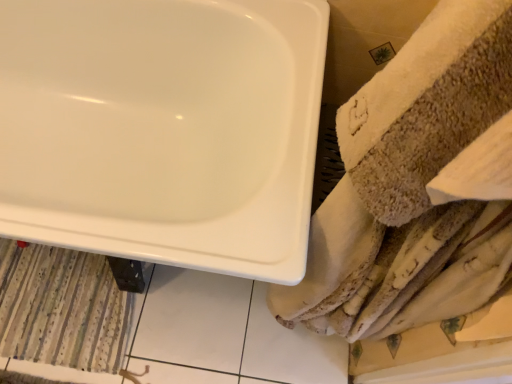
At what (x,y) coordinates should I click in order to perform the action: click on white glossy bathtub at upper left. Please return your answer as a coordinate pair (x, y). This screenshot has height=384, width=512. Looking at the image, I should click on (163, 129).

Measure the distance between white glossy bathtub at upper left and camera.

white glossy bathtub at upper left and camera are 27.33 inches apart.

Describe the element at coordinates (163, 129) in the screenshot. The height and width of the screenshot is (384, 512). I see `white glossy bathtub at upper left` at that location.

Locate an element on the screen. The height and width of the screenshot is (384, 512). striped fabric bath mat at lower left is located at coordinates (62, 308).

The image size is (512, 384). What do you see at coordinates (62, 308) in the screenshot?
I see `striped fabric bath mat at lower left` at bounding box center [62, 308].

The height and width of the screenshot is (384, 512). I want to click on white glossy bathtub at upper left, so click(x=163, y=129).

Which object is positioned more to the left, striped fabric bath mat at lower left or white glossy bathtub at upper left?

striped fabric bath mat at lower left is more to the left.

In the scene shown: Is the position of striped fabric bath mat at lower left more distant than that of white glossy bathtub at upper left?

That is True.

Does point (72, 354) lie behind point (214, 26)?

Yes, point (72, 354) is behind point (214, 26).

From the image's perspective, is striped fabric bath mat at lower left on white glossy bathtub at upper left?

Incorrect, from the image's perspective, striped fabric bath mat at lower left is lower than white glossy bathtub at upper left.

From a real-world perspective, is striped fabric bath mat at lower left above or below white glossy bathtub at upper left?

striped fabric bath mat at lower left is situated lower than white glossy bathtub at upper left in the real world.

Which object is thinner, striped fabric bath mat at lower left or white glossy bathtub at upper left?

Thinner between the two is striped fabric bath mat at lower left.

Between striped fabric bath mat at lower left and white glossy bathtub at upper left, which one has more height?

white glossy bathtub at upper left.

Between striped fabric bath mat at lower left and white glossy bathtub at upper left, which one has smaller size?

striped fabric bath mat at lower left is smaller.

Could white glossy bathtub at upper left be considered to be inside striped fabric bath mat at lower left?

That's incorrect, white glossy bathtub at upper left is not inside striped fabric bath mat at lower left.

Is striped fabric bath mat at lower left next to white glossy bathtub at upper left?

No, striped fabric bath mat at lower left is not with white glossy bathtub at upper left.

Is striped fabric bath mat at lower left facing away from white glossy bathtub at upper left?

Yes, striped fabric bath mat at lower left is positioned with its back facing white glossy bathtub at upper left.

Where is `sink located above the striped fabric bath mat at lower left (from a real-world perspective)`? The width and height of the screenshot is (512, 384). sink located above the striped fabric bath mat at lower left (from a real-world perspective) is located at coordinates (163, 129).

Which is more to the left, white glossy bathtub at upper left or striped fabric bath mat at lower left?

striped fabric bath mat at lower left is more to the left.

Is white glossy bathtub at upper left positioned before striped fabric bath mat at lower left?

Yes, white glossy bathtub at upper left is closer to the viewer.

Which is closer to the camera, (128, 155) or (42, 246)?

Point (128, 155) is positioned closer to the camera compared to point (42, 246).

From the image's perspective, is white glossy bathtub at upper left over striped fabric bath mat at lower left?

Yes, from the image's perspective, white glossy bathtub at upper left is over striped fabric bath mat at lower left.

Looking at this image, from a real-world perspective, does white glossy bathtub at upper left stand above striped fabric bath mat at lower left?

Indeed, from a real-world perspective, white glossy bathtub at upper left stands above striped fabric bath mat at lower left.

Which of these two, white glossy bathtub at upper left or striped fabric bath mat at lower left, is wider?

white glossy bathtub at upper left is wider.

Considering the sizes of objects white glossy bathtub at upper left and striped fabric bath mat at lower left in the image provided, who is taller, white glossy bathtub at upper left or striped fabric bath mat at lower left?

Standing taller between the two is white glossy bathtub at upper left.

Who is smaller, white glossy bathtub at upper left or striped fabric bath mat at lower left?

striped fabric bath mat at lower left is smaller.

Is white glossy bathtub at upper left positioned beyond the bounds of striped fabric bath mat at lower left?

Indeed, white glossy bathtub at upper left is completely outside striped fabric bath mat at lower left.

Would you consider white glossy bathtub at upper left to be distant from striped fabric bath mat at lower left?

Actually, white glossy bathtub at upper left and striped fabric bath mat at lower left are a little close together.

Is white glossy bathtub at upper left oriented away from striped fabric bath mat at lower left?

No, white glossy bathtub at upper left is not facing the opposite direction of striped fabric bath mat at lower left.

At what (x,y) coordinates should I click in order to perform the action: click on sink in front of the striped fabric bath mat at lower left. Please return your answer as a coordinate pair (x, y). The width and height of the screenshot is (512, 384). Looking at the image, I should click on (163, 129).

The width and height of the screenshot is (512, 384). I want to click on sink located above the striped fabric bath mat at lower left (from the image's perspective), so click(163, 129).

Where is `bath mat on the left of white glossy bathtub at upper left`? This screenshot has height=384, width=512. bath mat on the left of white glossy bathtub at upper left is located at coordinates (62, 308).